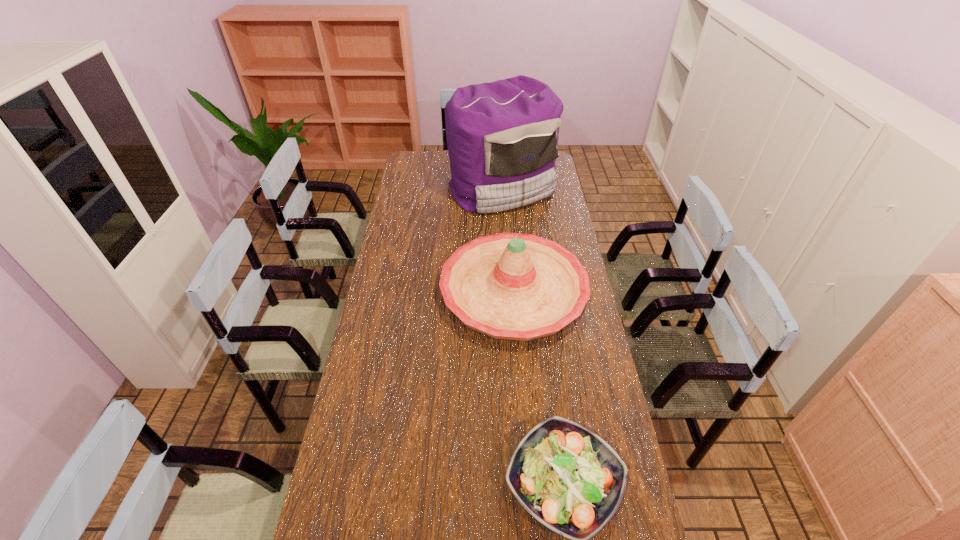
Where is `the farthest object`? This screenshot has height=540, width=960. the farthest object is located at coordinates (502, 137).

Find the location of a particular element. The width and height of the screenshot is (960, 540). the tallest object is located at coordinates (502, 137).

Locate an element on the screen. sombrero is located at coordinates (512, 286).

Locate an element on the screen. The width and height of the screenshot is (960, 540). the second farthest object is located at coordinates (512, 286).

Image resolution: width=960 pixels, height=540 pixels. Find the location of `free space located on the front pocket of the farthest object`. free space located on the front pocket of the farthest object is located at coordinates (505, 230).

Where is `vacant space located on the front of the second shortest object`? The height and width of the screenshot is (540, 960). vacant space located on the front of the second shortest object is located at coordinates (521, 402).

Locate an element on the screen. object positioned at the far edge is located at coordinates (502, 137).

Locate an element on the screen. The image size is (960, 540). backpack present at the right edge is located at coordinates (502, 137).

At what (x,y) coordinates should I click in order to perform the action: click on sombrero that is at the right edge. Please return your answer as a coordinate pair (x, y). The image size is (960, 540). Looking at the image, I should click on (512, 286).

The height and width of the screenshot is (540, 960). Find the location of `object located at the far right corner`. object located at the far right corner is located at coordinates (502, 137).